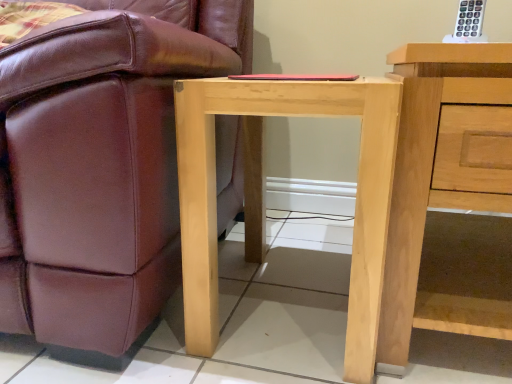
Question: Is natural wood table at center to the right of natural wood nightstand at right from the viewer's perspective?

Choices:
 (A) no
 (B) yes

Answer: (A)

Question: Does natural wood table at center have a greater width compared to natural wood nightstand at right?

Choices:
 (A) yes
 (B) no

Answer: (B)

Question: Considering the relative sizes of natural wood table at center and natural wood nightstand at right in the image provided, is natural wood table at center thinner than natural wood nightstand at right?

Choices:
 (A) no
 (B) yes

Answer: (B)

Question: Can you confirm if natural wood table at center is shorter than natural wood nightstand at right?

Choices:
 (A) yes
 (B) no

Answer: (A)

Question: Is natural wood table at center positioned beyond the bounds of natural wood nightstand at right?

Choices:
 (A) yes
 (B) no

Answer: (A)

Question: Is natural wood table at center smaller than natural wood nightstand at right?

Choices:
 (A) yes
 (B) no

Answer: (A)

Question: Does natural wood nightstand at right have a smaller size compared to matte brown leather chair at lower left?

Choices:
 (A) no
 (B) yes

Answer: (B)

Question: Considering the relative sizes of natural wood nightstand at right and matte brown leather chair at lower left in the image provided, is natural wood nightstand at right thinner than matte brown leather chair at lower left?

Choices:
 (A) no
 (B) yes

Answer: (B)

Question: Does natural wood nightstand at right have a lesser height compared to matte brown leather chair at lower left?

Choices:
 (A) no
 (B) yes

Answer: (B)

Question: Is natural wood nightstand at right facing away from matte brown leather chair at lower left?

Choices:
 (A) yes
 (B) no

Answer: (B)

Question: Is natural wood nightstand at right at the right side of matte brown leather chair at lower left?

Choices:
 (A) no
 (B) yes

Answer: (B)

Question: Does natural wood nightstand at right have a greater width compared to matte brown leather chair at lower left?

Choices:
 (A) no
 (B) yes

Answer: (A)

Question: Is natural wood nightstand at right surrounding natural wood table at center?

Choices:
 (A) no
 (B) yes

Answer: (A)